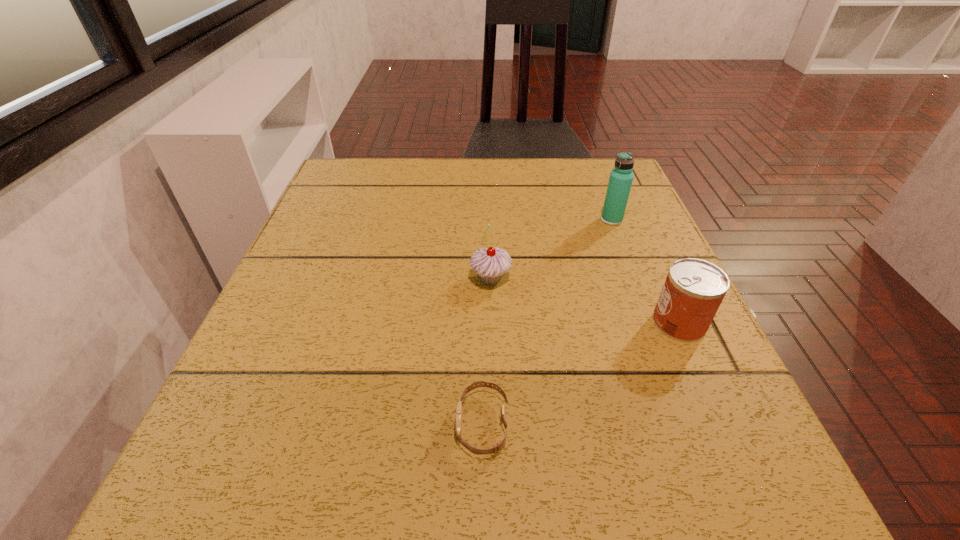
The width and height of the screenshot is (960, 540). What are the coordinates of `free area in between the shortest object and the cupcake` in the screenshot? It's located at (487, 352).

This screenshot has width=960, height=540. I want to click on the closest object to the cupcake, so click(496, 448).

At what (x,y) coordinates should I click in order to perform the action: click on the closest object to the tallest object. Please return your answer as a coordinate pair (x, y). The width and height of the screenshot is (960, 540). Looking at the image, I should click on (693, 290).

This screenshot has height=540, width=960. What are the coordinates of `vacant space that satisfies the following two spatial constraints: 1. on the front side of the second nearest object; 2. on the right side of the tallest object` in the screenshot? It's located at (652, 323).

Find the location of a particular element. free location that satisfies the following two spatial constraints: 1. on the front side of the can; 2. on the face of the shortest object is located at coordinates (725, 424).